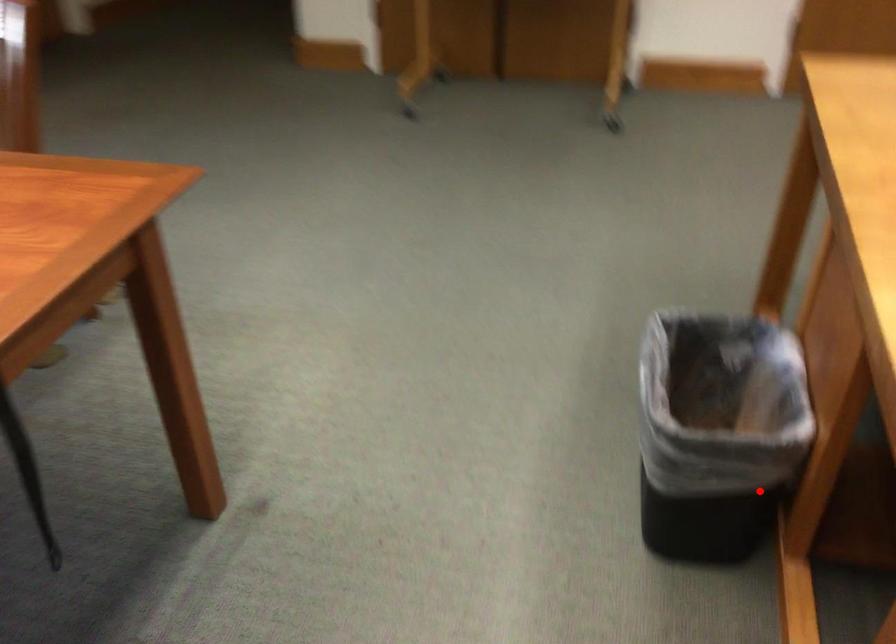
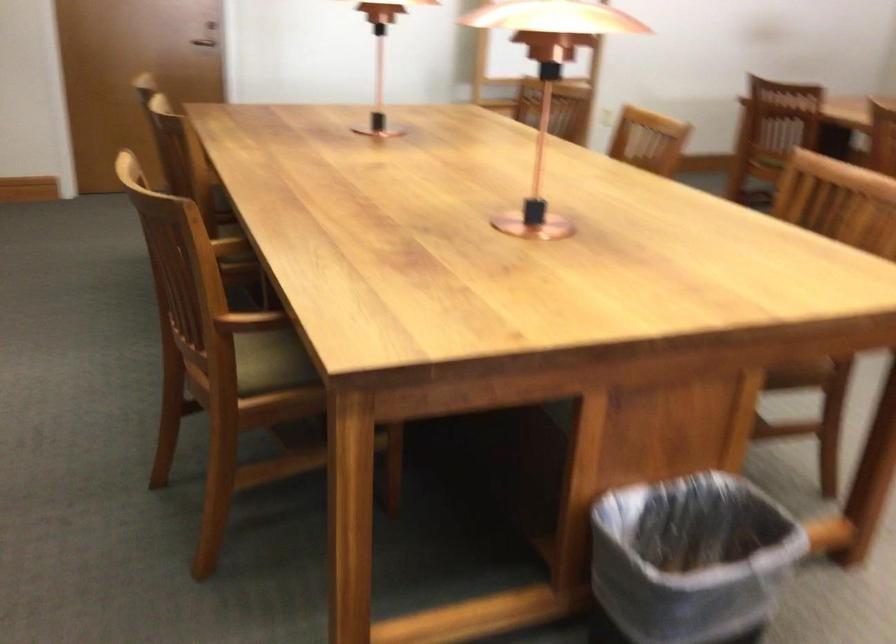
The point at the highlighted location is marked in the first image. Where is the corresponding point in the second image?

(691, 560)